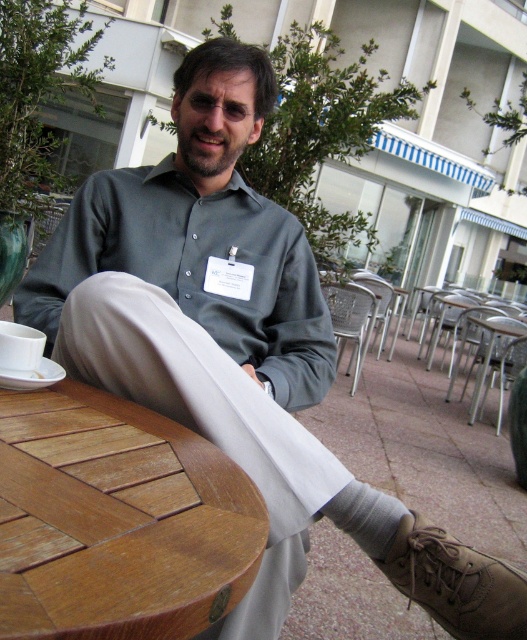
You are a GUI agent. You are given a task and a screenshot of the screen. Output one action in this format:
    pyautogui.click(x=<x>, y=<y>)
    Task: Click on the brown wooden table at center
    The image size is (527, 640).
    Given the screenshot: What is the action you would take?
    pyautogui.click(x=116, y=520)

Is point (239, 477) in front of point (502, 566)?

Yes, it is in front of point (502, 566).

Identify the location of brown wooden table at center. tap(116, 520).

Is brown wooden table at center to the right of gray knitted sock at lower center from the viewer's perspective?

No, brown wooden table at center is not to the right of gray knitted sock at lower center.

Between brown wooden table at center and gray knitted sock at lower center, which one has less height?

brown wooden table at center

Is point (258, 563) farther from camera compared to point (365, 525)?

No, it is not.

Identify the location of brown wooden table at center. The height and width of the screenshot is (640, 527). (116, 520).

Does tan leather shoe at lower right have a greater width compared to gray knitted sock at lower center?

Correct, the width of tan leather shoe at lower right exceeds that of gray knitted sock at lower center.

Identify the location of tan leather shoe at lower right. (455, 582).

Which is behind, point (473, 637) or point (320, 513)?

Point (320, 513)

You are a GUI agent. You are given a task and a screenshot of the screen. Output one action in this format:
    pyautogui.click(x=<x>, y=<y>)
    Task: Click on the tan leather shoe at lower right
    The height and width of the screenshot is (640, 527).
    Given the screenshot: What is the action you would take?
    pyautogui.click(x=455, y=582)